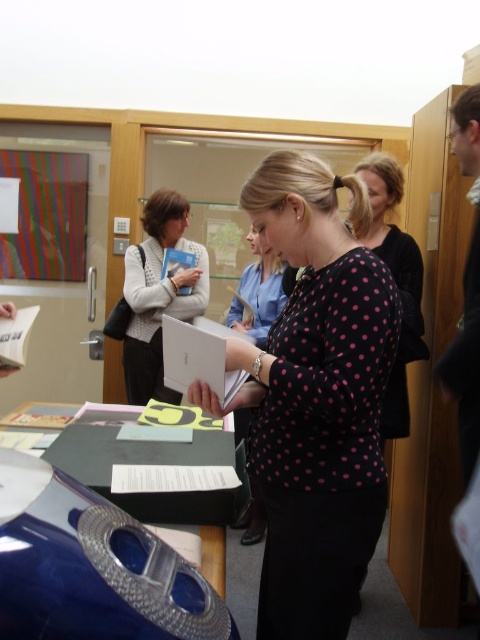
You are organizing a photo shoot in this library scene. You need to place a large poster behind the black dotted shirt at center and the shiny blue table at center. Which object should the poster be placed behind to ensure it doesn t block either of them?

The poster should be placed behind the black dotted shirt at center because it is larger than the shiny blue table at center and can accommodate the poster without blocking both objects.

You are standing in the library and want to place a new book on the shiny blue table at center. However, there is multicolored striped paper at left in the way. Can you reach the table without moving the paper?

The multicolored striped paper at left is further to the viewer than shiny blue table at center, meaning the table is closer to you. Therefore, you can reach the shiny blue table at center without needing to move the multicolored striped paper at left since it is behind the table.